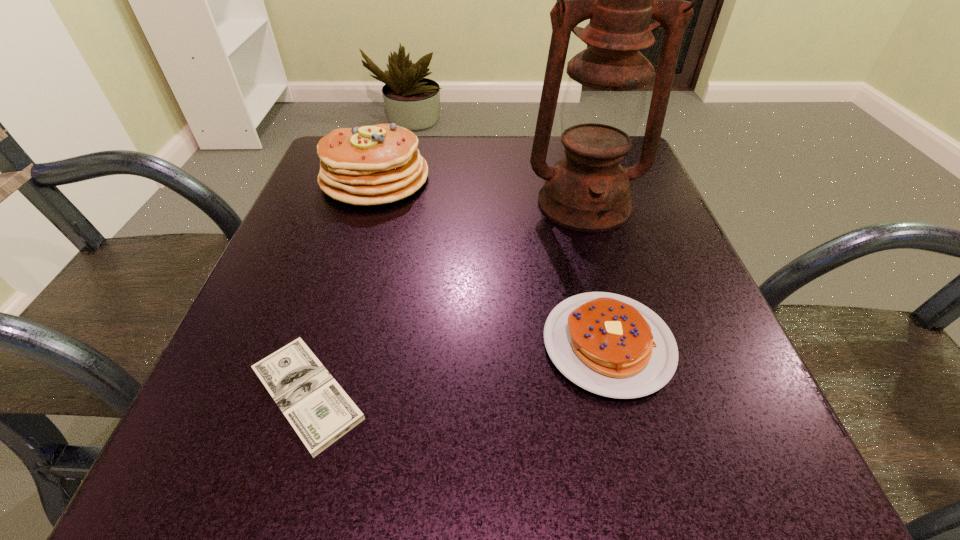
This screenshot has height=540, width=960. I want to click on free space between the shortest object and the third shortest object, so click(341, 286).

Where is `unoccupied area between the dollar and the shorter pancake`? Image resolution: width=960 pixels, height=540 pixels. unoccupied area between the dollar and the shorter pancake is located at coordinates (458, 369).

This screenshot has width=960, height=540. I want to click on free space between the shortest object and the oil lamp, so click(x=445, y=299).

Find the location of a particular element. This screenshot has height=540, width=960. free space between the shorter pancake and the oil lamp is located at coordinates (596, 274).

This screenshot has height=540, width=960. In order to click on free space between the oil lamp and the shortest object in this screenshot , I will do `click(445, 299)`.

Find the location of a particular element. The width and height of the screenshot is (960, 540). object that stands as the closest to the shortest object is located at coordinates (611, 345).

Identify which object is the closest to the oil lamp. Please provide its 2D coordinates. Your answer should be formatted as a tuple, i.e. [(x, y)], where the tuple contains the x and y coordinates of a point satisfying the conditions above.

[(611, 345)]

The width and height of the screenshot is (960, 540). I want to click on free space in the image that satisfies the following two spatial constraints: 1. on the front side of the farther pancake; 2. on the left side of the oil lamp, so click(x=368, y=203).

You are a GUI agent. You are given a task and a screenshot of the screen. Output one action in this format:
    pyautogui.click(x=<x>, y=<y>)
    Task: Click on the free location that satisfies the following two spatial constraints: 1. on the back side of the right pancake; 2. on the right side of the tallest object
    The height and width of the screenshot is (540, 960).
    Given the screenshot: What is the action you would take?
    pyautogui.click(x=572, y=203)